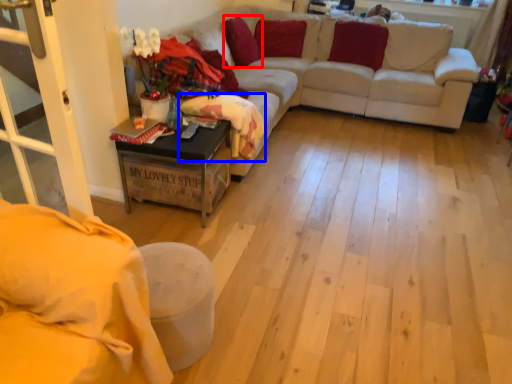
Question: Which object is closer to the camera taking this photo, pillow (highlighted by a red box) or blanket (highlighted by a blue box)?

Choices:
 (A) pillow
 (B) blanket

Answer: (B)